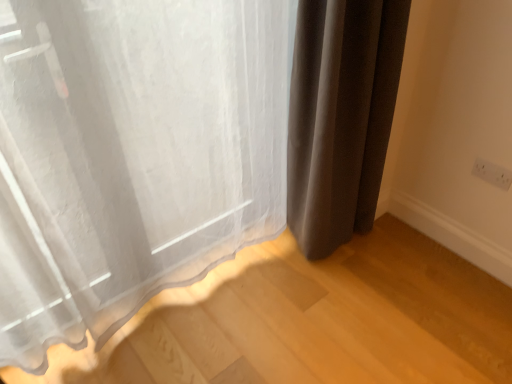
Locate an element on the screen. The image size is (512, 384). vacant position to the left of dark velvet curtain at right is located at coordinates (264, 264).